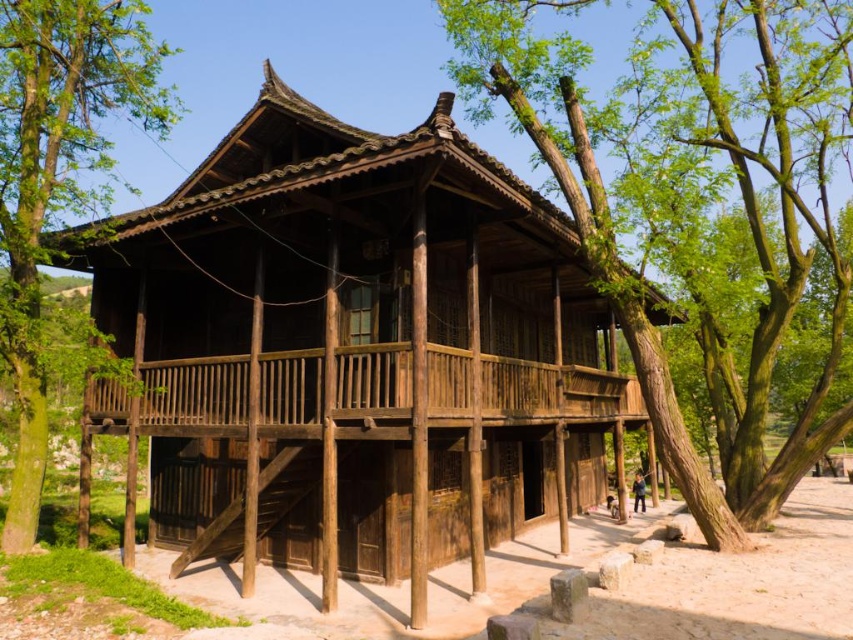
Can you confirm if green wood tree at left is wider than green wood tree at center?

Yes, green wood tree at left is wider than green wood tree at center.

Does point (25, 74) lie behind point (650, 330)?

Yes, it is.

Locate an element on the screen. green wood tree at left is located at coordinates tap(57, 173).

Does wooden house at center have a lesser width compared to green wood tree at left?

No.

Which is more to the right, wooden house at center or green wood tree at left?

wooden house at center

Describe the element at coordinates (352, 348) in the screenshot. I see `wooden house at center` at that location.

Locate an element on the screen. The width and height of the screenshot is (853, 640). wooden house at center is located at coordinates (352, 348).

Which is more to the left, wooden house at center or green wood tree at center?

wooden house at center is more to the left.

You are a GUI agent. You are given a task and a screenshot of the screen. Output one action in this format:
    pyautogui.click(x=<x>, y=<y>)
    Task: Click on the wooden house at center
    
    Given the screenshot: What is the action you would take?
    pyautogui.click(x=352, y=348)

You are a GUI agent. You are given a task and a screenshot of the screen. Output one action in this format:
    pyautogui.click(x=<x>, y=<y>)
    Task: Click on the wooden house at center
    The width and height of the screenshot is (853, 640).
    Given the screenshot: What is the action you would take?
    tap(352, 348)